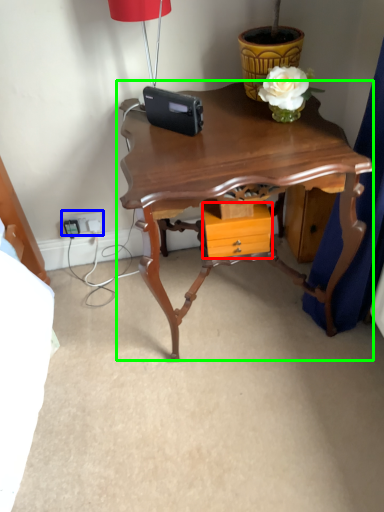
Question: Estimate the real-world distances between objects in this image. Which object is closer to drawer (highlighted by a red box), electric outlet (highlighted by a blue box) or table (highlighted by a green box)?

Choices:
 (A) electric outlet
 (B) table

Answer: (B)